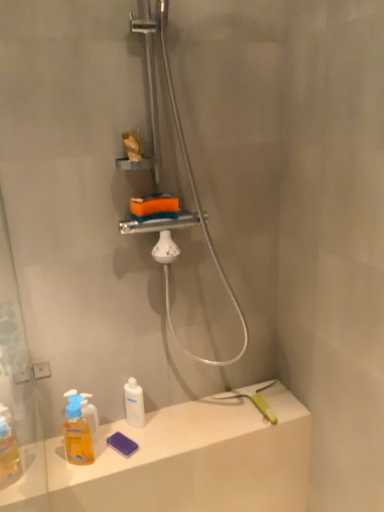
This screenshot has height=512, width=384. What are the coordinates of `vacant area situated below metallic silver shower at upper center (from a real-world perspective)` in the screenshot? It's located at (189, 430).